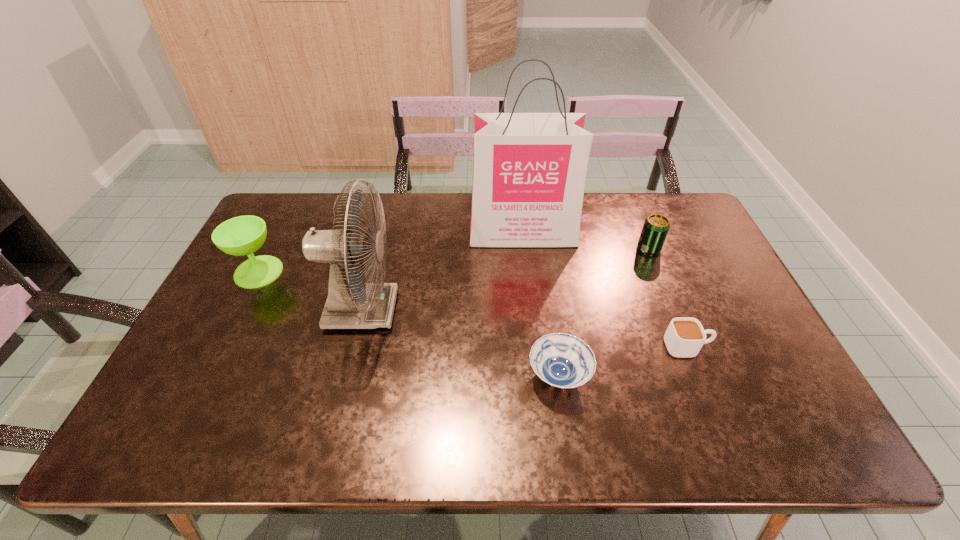
Where is `free space that is in between the cup and the second tallest object`? The image size is (960, 540). free space that is in between the cup and the second tallest object is located at coordinates (524, 328).

Locate an element on the screen. The width and height of the screenshot is (960, 540). free spot between the second tallest object and the leftmost object is located at coordinates (310, 291).

At what (x,y) coordinates should I click in order to perform the action: click on the fourth closest object to the fourth tallest object. Please return your answer as a coordinate pair (x, y). The image size is (960, 540). Looking at the image, I should click on (352, 303).

The height and width of the screenshot is (540, 960). Find the location of `the fifth closest object to the soup bowl`. the fifth closest object to the soup bowl is located at coordinates (239, 236).

The width and height of the screenshot is (960, 540). I want to click on free space in the image that satisfies the following two spatial constraints: 1. on the front side of the soup bowl; 2. on the left side of the wineglass, so click(205, 375).

This screenshot has height=540, width=960. I want to click on vacant space that satisfies the following two spatial constraints: 1. on the front-facing side of the fifth object from right to left; 2. on the back side of the soup bowl, so click(x=346, y=375).